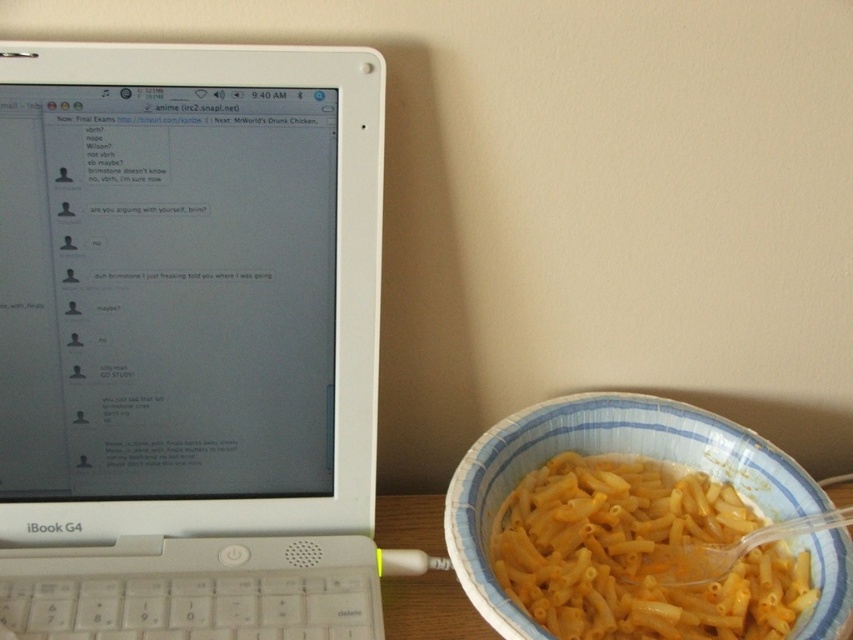
Question: Which point appears closest to the camera in this image?

Choices:
 (A) (91, 540)
 (B) (720, 632)

Answer: (B)

Question: Is white plastic laptop at left above yellow matte pasta at right?

Choices:
 (A) no
 (B) yes

Answer: (B)

Question: Which of the following is the farthest from the observer?

Choices:
 (A) (579, 509)
 (B) (227, 292)

Answer: (A)

Question: Which of the following is the closest to the observer?

Choices:
 (A) white plastic laptop at left
 (B) yellow matte pasta at right

Answer: (A)

Question: In this image, where is white plastic laptop at left located relative to yellow matte pasta at right?

Choices:
 (A) below
 (B) above

Answer: (B)

Question: Can you confirm if white plastic laptop at left is positioned above yellow matte pasta at right?

Choices:
 (A) no
 (B) yes

Answer: (B)